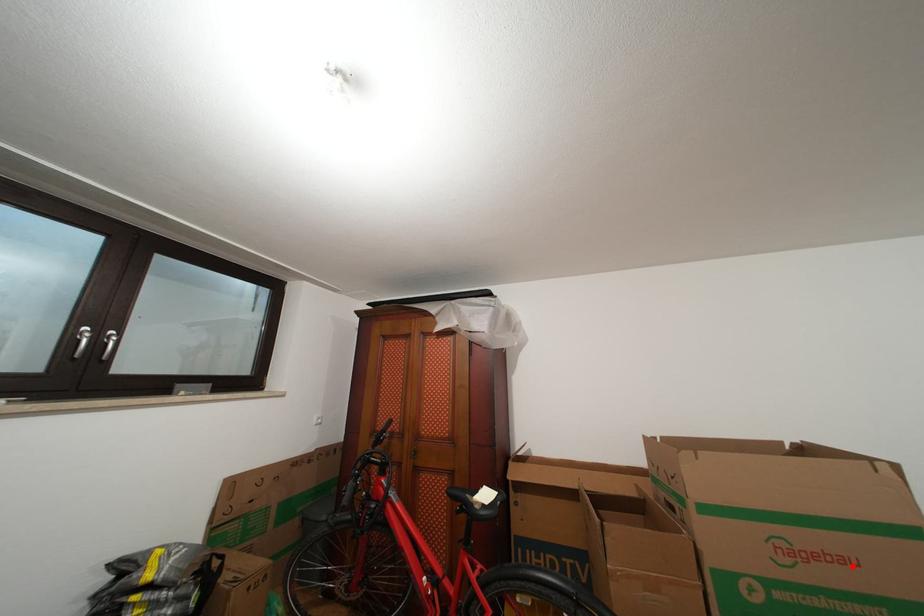
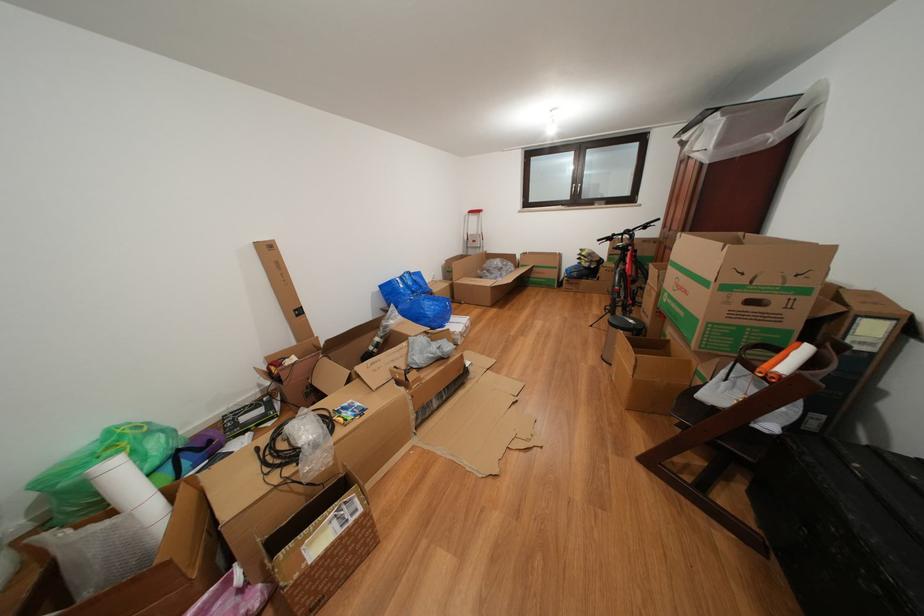
In the second image, find the point that corresponds to the highlighted location in the first image.

(694, 297)